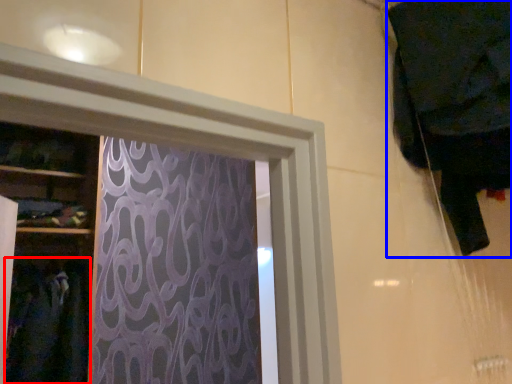
Question: Which object appears farthest to the camera in this image, clothing (highlighted by a red box) or clothing (highlighted by a blue box)?

Choices:
 (A) clothing
 (B) clothing

Answer: (A)